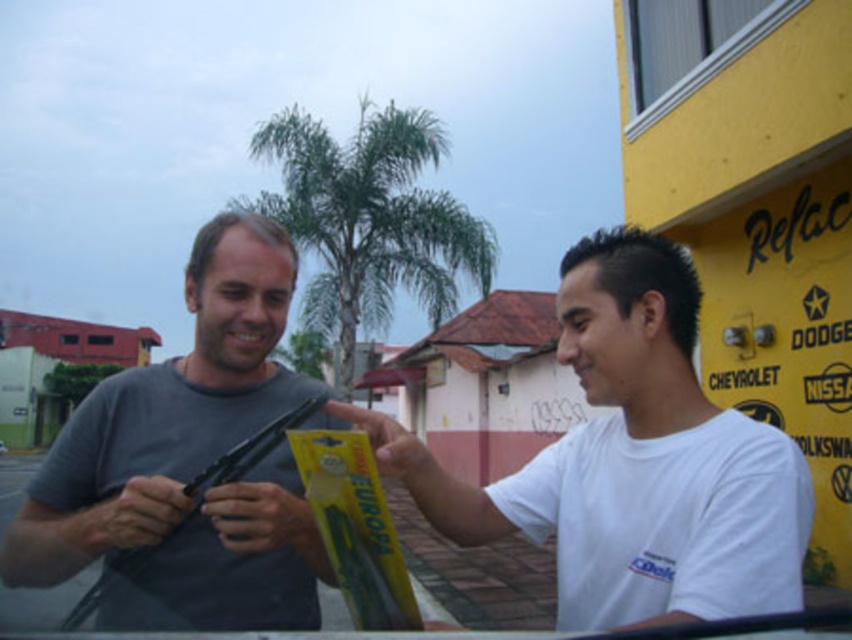
Is matte gray shirt at center in front of green leafy palm tree at center?

Yes, matte gray shirt at center is closer to the viewer.

Does matte gray shirt at center appear on the right side of green leafy palm tree at center?

Indeed, matte gray shirt at center is positioned on the right side of green leafy palm tree at center.

The width and height of the screenshot is (852, 640). What are the coordinates of `matte gray shirt at center` in the screenshot? It's located at (187, 464).

Find the location of `matte gray shirt at center`. matte gray shirt at center is located at coordinates (x=187, y=464).

Can you confirm if matte gray shirt at center is thinner than yellow plastic package at center?

In fact, matte gray shirt at center might be wider than yellow plastic package at center.

Does matte gray shirt at center have a greater height compared to yellow plastic package at center?

Yes, matte gray shirt at center is taller than yellow plastic package at center.

Is point (312, 616) closer to viewer compared to point (367, 545)?

That is False.

The width and height of the screenshot is (852, 640). Find the location of `matte gray shirt at center`. matte gray shirt at center is located at coordinates pos(187,464).

Is white matte shirt at center positioned behind yellow plastic package at center?

No, white matte shirt at center is closer to the viewer.

Describe the element at coordinates (632, 461) in the screenshot. I see `white matte shirt at center` at that location.

Is point (760, 499) less distant than point (298, 464)?

Yes.

This screenshot has height=640, width=852. What are the coordinates of `white matte shirt at center` in the screenshot? It's located at (632, 461).